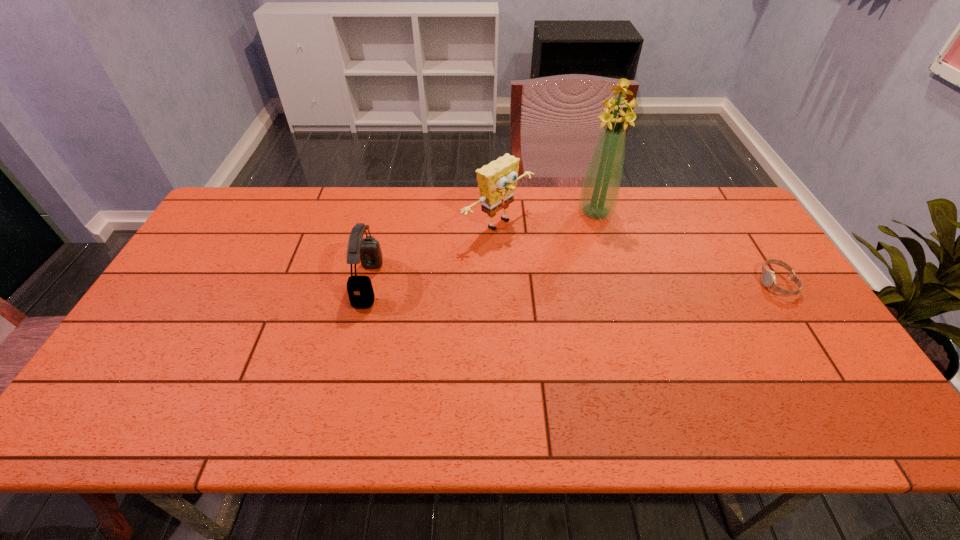
Find the location of a particular element. The width and height of the screenshot is (960, 540). free space between the shortest object and the headset is located at coordinates (572, 283).

The width and height of the screenshot is (960, 540). Identify the location of free spot between the third object from left to right and the second object from left to right. (547, 218).

At what (x,y) coordinates should I click in order to perform the action: click on empty space between the bouquet and the second shortest object. Please return your answer as a coordinate pair (x, y). The height and width of the screenshot is (540, 960). Looking at the image, I should click on click(482, 247).

Identify the location of free spot between the watch and the tallest object. The width and height of the screenshot is (960, 540). (686, 247).

At what (x,y) coordinates should I click in order to perform the action: click on vacant point located between the third object from left to right and the shortest object. Please return your answer as a coordinate pair (x, y). This screenshot has height=540, width=960. Looking at the image, I should click on (686, 247).

Find the location of a particular element. Image resolution: width=960 pixels, height=540 pixels. vacant region between the shortest object and the headset is located at coordinates (572, 283).

Where is `object that is the closest one to the watch`? The width and height of the screenshot is (960, 540). object that is the closest one to the watch is located at coordinates (600, 189).

Identify the location of the third closest object to the third object from left to right. (367, 250).

Find the location of `vacant space that satisfies the following two spatial constraints: 1. on the back side of the second object from left to right; 2. on the right side of the second object from right to left`. vacant space that satisfies the following two spatial constraints: 1. on the back side of the second object from left to right; 2. on the right side of the second object from right to left is located at coordinates tap(497, 211).

Where is `vacant space that satisfies the following two spatial constraints: 1. on the front side of the shortest object; 2. on the face of the bouquet`? vacant space that satisfies the following two spatial constraints: 1. on the front side of the shortest object; 2. on the face of the bouquet is located at coordinates (616, 283).